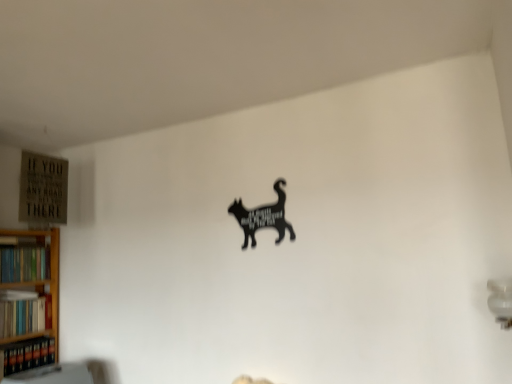
Question: From the image's perspective, is hardcover books at left, the 1th book positioned from the top, under black matte cat at center?

Choices:
 (A) no
 (B) yes

Answer: (B)

Question: Can you confirm if hardcover books at left, the 1th book positioned from the top, is smaller than black matte cat at center?

Choices:
 (A) yes
 (B) no

Answer: (B)

Question: Can you confirm if hardcover books at left, positioned as the third book in bottom-to-top order, is thinner than black matte cat at center?

Choices:
 (A) yes
 (B) no

Answer: (B)

Question: From a real-world perspective, is hardcover books at left, the 1th book positioned from the top, on top of black matte cat at center?

Choices:
 (A) yes
 (B) no

Answer: (B)

Question: Is hardcover books at left, the 1th book positioned from the top, turned away from black matte cat at center?

Choices:
 (A) yes
 (B) no

Answer: (B)

Question: Is black matte cat at center situated inside hardcover books at left, the 1th book positioned from the top, or outside?

Choices:
 (A) inside
 (B) outside

Answer: (B)

Question: From a real-world perspective, is black matte cat at center positioned above or below hardcover books at left, positioned as the third book in bottom-to-top order?

Choices:
 (A) below
 (B) above

Answer: (B)

Question: Is point (245, 248) closer or farther from the camera than point (27, 271)?

Choices:
 (A) farther
 (B) closer

Answer: (B)

Question: Is black matte cat at center in front of or behind hardcover books at left, the 1th book positioned from the top, in the image?

Choices:
 (A) behind
 (B) front

Answer: (B)

Question: Looking at the image, does hardcover books at left, positioned as the third book in bottom-to-top order, seem bigger or smaller compared to black matte cat at center?

Choices:
 (A) small
 (B) big

Answer: (B)

Question: Is hardcover books at left, positioned as the third book in bottom-to-top order, inside or outside of black matte cat at center?

Choices:
 (A) inside
 (B) outside

Answer: (B)

Question: From a real-world perspective, is hardcover books at left, the 1th book positioned from the top, positioned above or below black matte cat at center?

Choices:
 (A) above
 (B) below

Answer: (B)

Question: Considering their positions, is hardcover books at left, positioned as the third book in bottom-to-top order, located in front of or behind black matte cat at center?

Choices:
 (A) front
 (B) behind

Answer: (B)

Question: Is point (23, 359) positioned closer to the camera than point (261, 208)?

Choices:
 (A) closer
 (B) farther

Answer: (B)

Question: From the image's perspective, relative to black matte cat at center, is hardcover books at lower left, which is the third book in top-to-bottom order, above or below?

Choices:
 (A) below
 (B) above

Answer: (A)